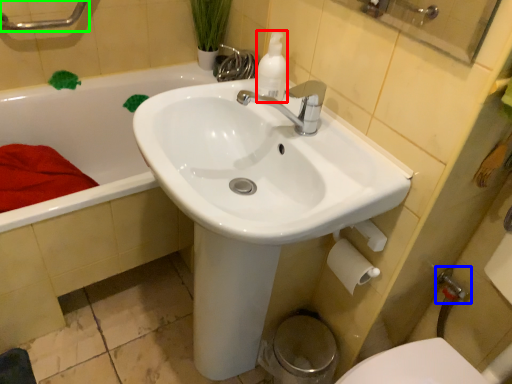
Question: Based on their relative distances, which object is farther from cleaning product (highlighted by a red box)? Choose from plumbing fixture (highlighted by a blue box) and shower (highlighted by a green box).

Choices:
 (A) plumbing fixture
 (B) shower

Answer: (B)